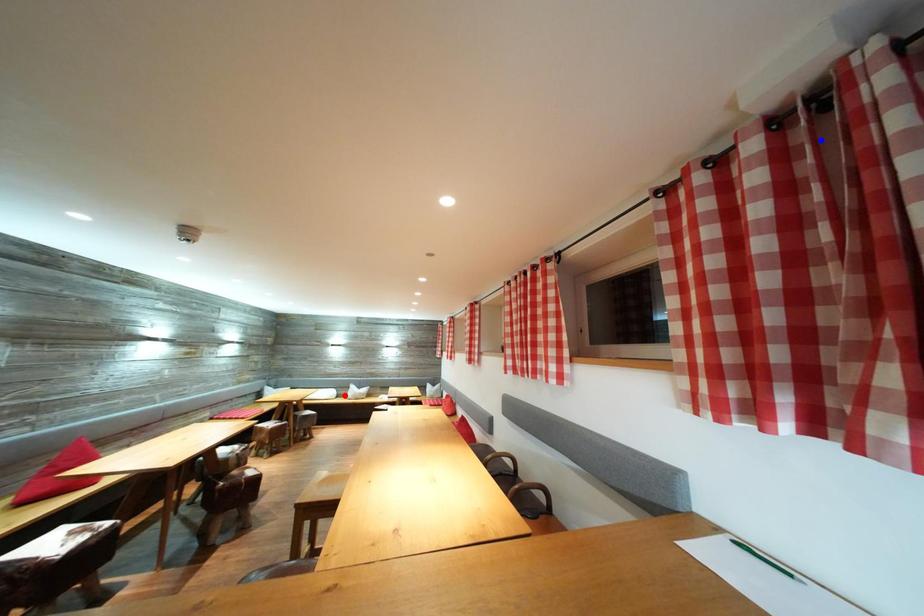
Question: Which of the two points in the image is closer to the camera?

Choices:
 (A) Blue point is closer.
 (B) Red point is closer.

Answer: (A)